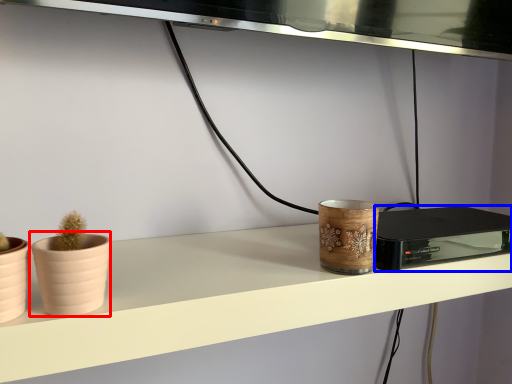
Question: Which object is further to the camera taking this photo, flowerpot (highlighted by a red box) or appliance (highlighted by a blue box)?

Choices:
 (A) flowerpot
 (B) appliance

Answer: (B)